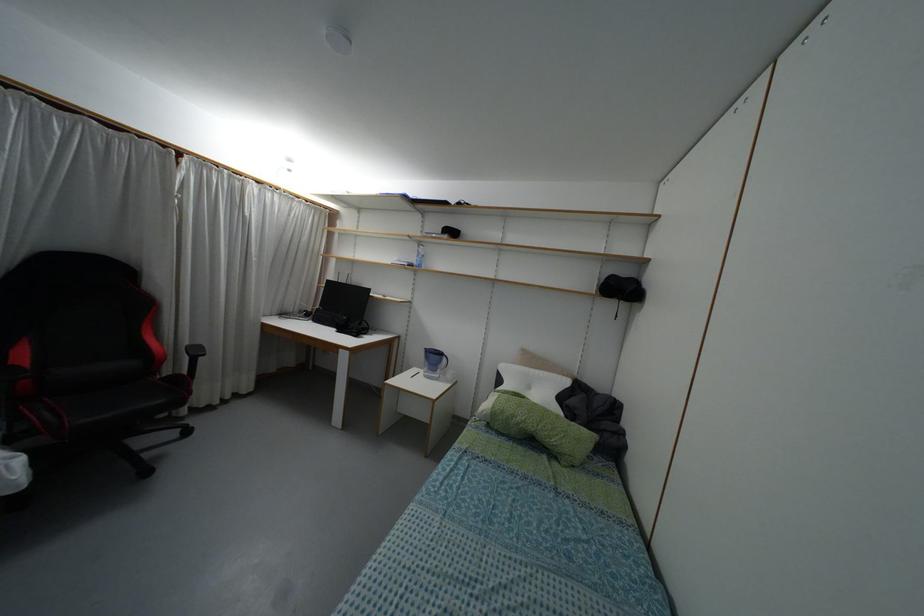
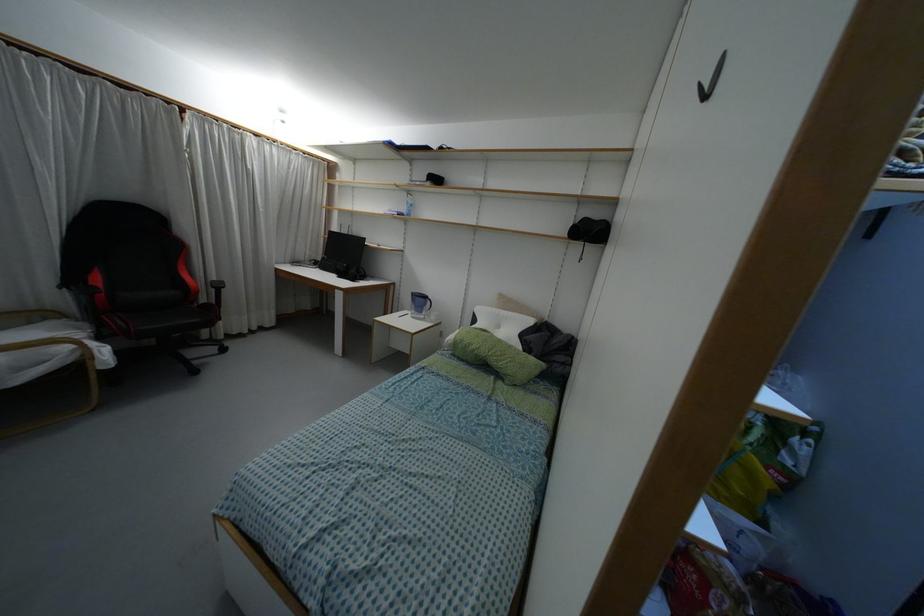
Find the pixel in the second image that matches (x=444, y=359) in the first image.

(428, 302)